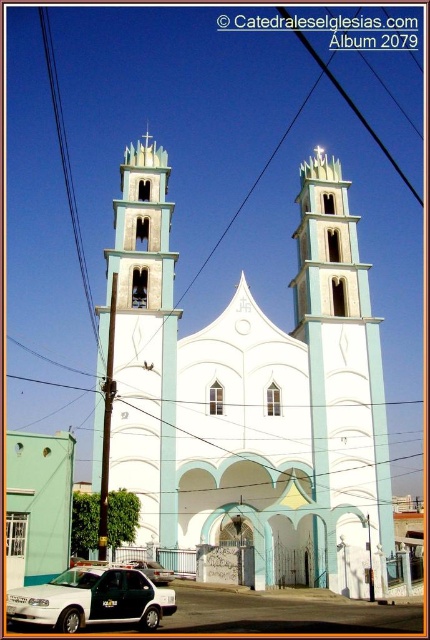
Question: Which of these objects is positioned closest to the white matte car at lower left?

Choices:
 (A) black wire at left
 (B) white stucco tower at center

Answer: (B)

Question: Which point is farther to the camera?

Choices:
 (A) (303, 326)
 (B) (89, 310)
 (C) (270, 540)
 (D) (89, 582)

Answer: (B)

Question: Is white stucco tower at center behind white matte car at lower left?

Choices:
 (A) yes
 (B) no

Answer: (A)

Question: Which object is farther from the camera taking this photo?

Choices:
 (A) white smooth church at center
 (B) black wire at left
 (C) metallic silver sedan at lower left
 (D) light blue concrete tower at center

Answer: (B)

Question: Is white smooth church at center above metallic silver sedan at lower left?

Choices:
 (A) no
 (B) yes

Answer: (B)

Question: Does white smooth church at center have a smaller size compared to black wire at left?

Choices:
 (A) yes
 (B) no

Answer: (B)